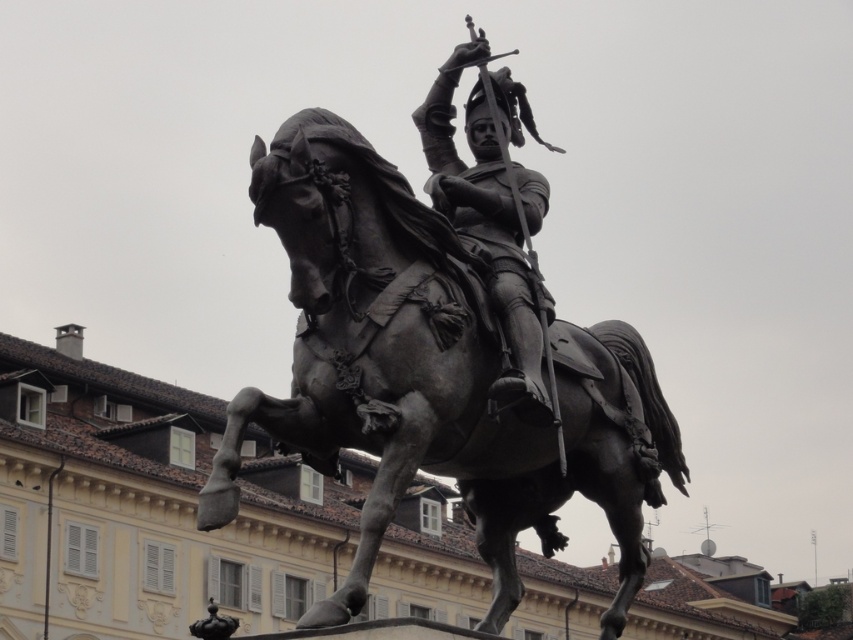
You are an art student analyzing the bronze equestrian statue. Based on the scene, which object, the bronze horse at center or the polished bronze knight at center, would you say is bigger in size?

The bronze horse at center is larger in size than the polished bronze knight at center.

You are standing in front of the bronze equestrian statue and looking at the two points marked in the image. Which point, point (515,592) or point (494,77), is nearer to your eyes?

Point (515,592) is closer to the camera than point (494,77), so it is nearer to your eyes.

You are an art student observing the bronze equestrian statue. You notice the bronze horse at center and the polished bronze knight at center. Which of these two figures is taller?

The bronze horse at center is much taller than the polished bronze knight at center according to the description.